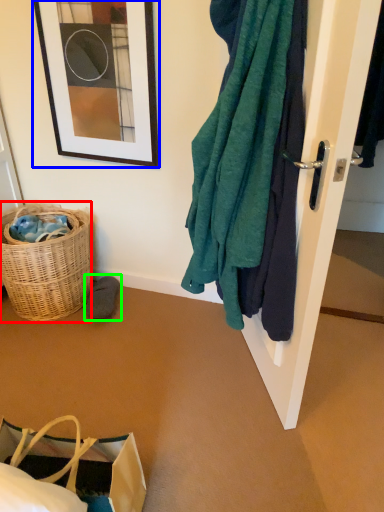
Question: Considering the real-world distances, which object is farthest from picnic basket (highlighted by a red box)? picture frame (highlighted by a blue box) or footwear (highlighted by a green box)?

Choices:
 (A) picture frame
 (B) footwear

Answer: (A)